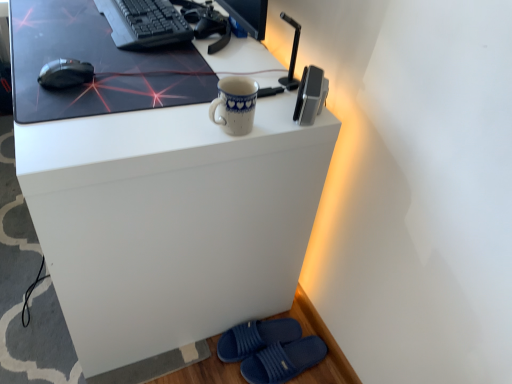
Identify the location of free space above matte black mousepad at upper center (from a real-world perspective). (95, 43).